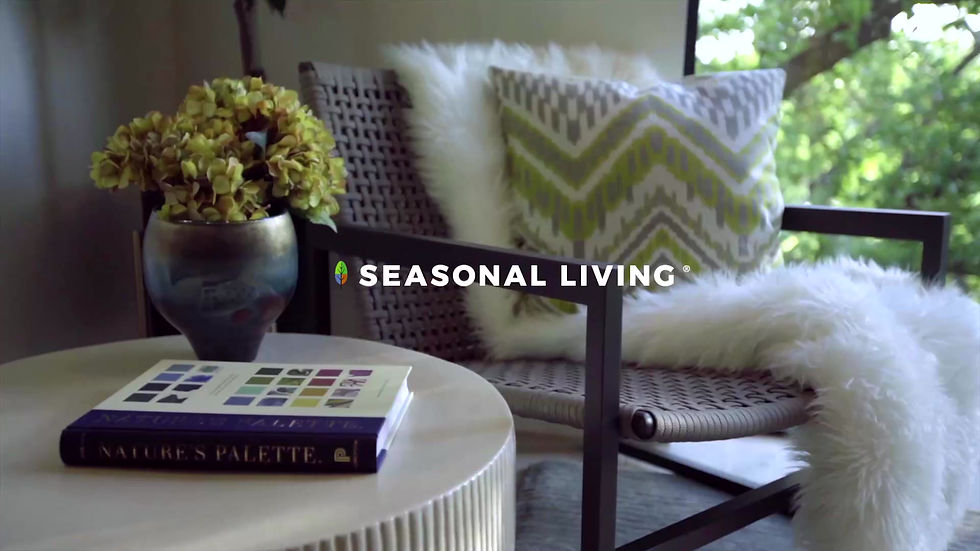
The height and width of the screenshot is (551, 980). What are the coordinates of `book` in the screenshot? It's located at (245, 424).